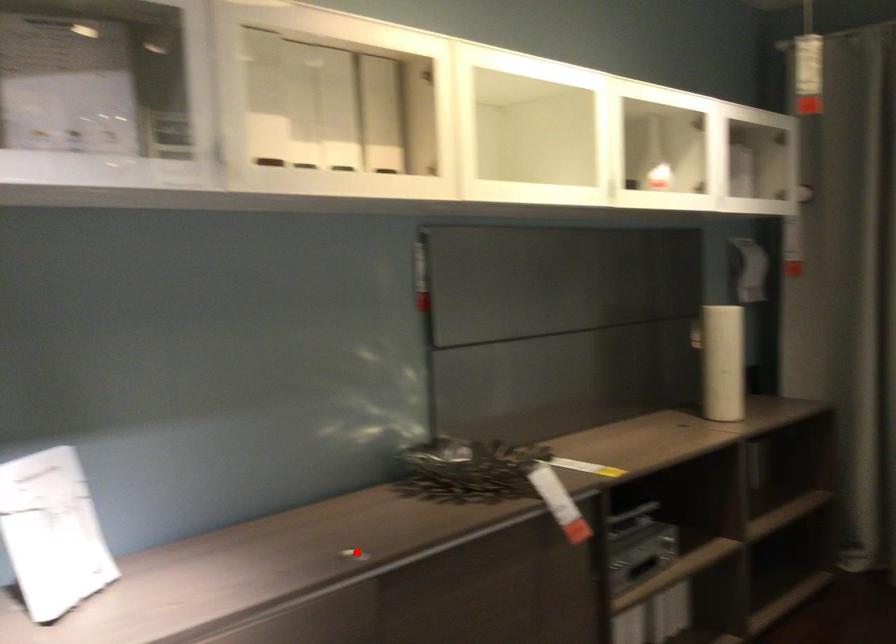
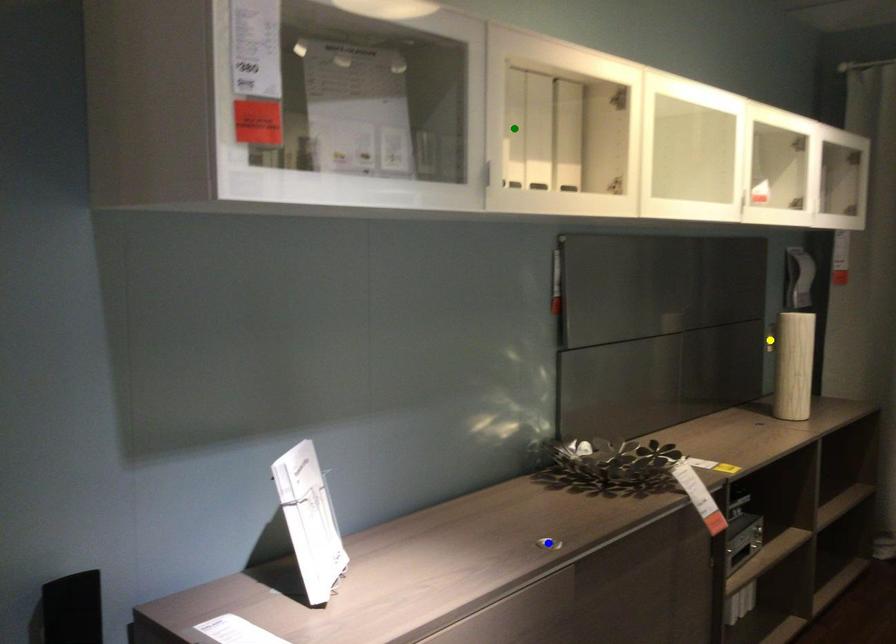
Question: I am providing you with two images of the same scene from different viewpoints. A red point is marked on the first image. You are given multiple points on the second image. Which mark in image 2 goes with the point in image 1?

Choices:
 (A) blue point
 (B) green point
 (C) yellow point

Answer: (A)